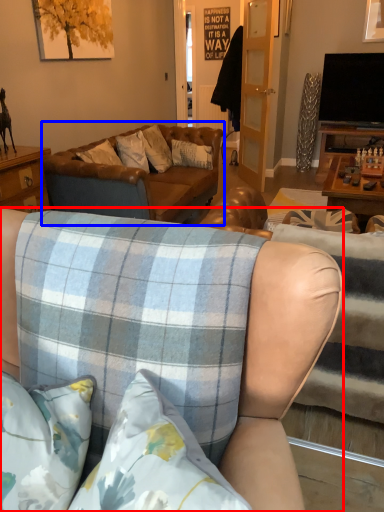
Question: Which object is closer to the camera taking this photo, studio couch (highlighted by a red box) or studio couch (highlighted by a blue box)?

Choices:
 (A) studio couch
 (B) studio couch

Answer: (A)